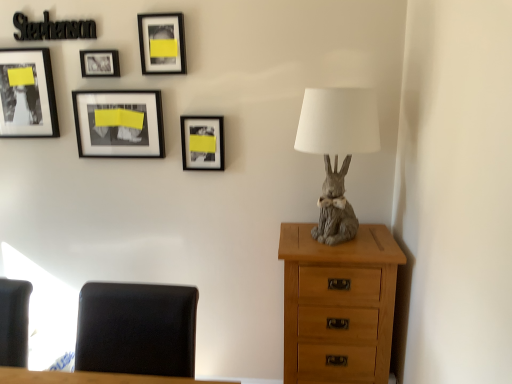
Question: Does light brown wood chest of drawers at right have a greater width compared to matte black frame at upper left, which ranks as the first picture frame in left-to-right order?

Choices:
 (A) yes
 (B) no

Answer: (A)

Question: Can we say light brown wood chest of drawers at right lies outside matte black frame at upper left, which ranks as the first picture frame in left-to-right order?

Choices:
 (A) yes
 (B) no

Answer: (A)

Question: Are light brown wood chest of drawers at right and matte black frame at upper left, which ranks as the first picture frame in left-to-right order, located far from each other?

Choices:
 (A) no
 (B) yes

Answer: (B)

Question: Considering the relative sizes of light brown wood chest of drawers at right and matte black frame at upper left, which ranks as the first picture frame in left-to-right order, in the image provided, is light brown wood chest of drawers at right thinner than matte black frame at upper left, which ranks as the first picture frame in left-to-right order,?

Choices:
 (A) no
 (B) yes

Answer: (A)

Question: Can you see light brown wood chest of drawers at right touching matte black frame at upper left, the fifth picture frame in the right-to-left sequence?

Choices:
 (A) yes
 (B) no

Answer: (B)

Question: Is black leather chair at lower left spatially inside matte black picture frame at center, which is the first picture frame in right-to-left order, or outside of it?

Choices:
 (A) inside
 (B) outside

Answer: (B)

Question: Is black leather chair at lower left in front of or behind matte black picture frame at center, which is the first picture frame in right-to-left order, in the image?

Choices:
 (A) front
 (B) behind

Answer: (A)

Question: Is point (193, 336) closer or farther from the camera than point (197, 127)?

Choices:
 (A) closer
 (B) farther

Answer: (A)

Question: In terms of height, does black leather chair at lower left look taller or shorter compared to matte black picture frame at center, which is the first picture frame in right-to-left order?

Choices:
 (A) tall
 (B) short

Answer: (A)

Question: In the image, is light brown wood chest of drawers at right on the left side or the right side of matte black frame at upper center, which is counted as the 2th picture frame, starting from the right?

Choices:
 (A) left
 (B) right

Answer: (B)

Question: Considering the positions of light brown wood chest of drawers at right and matte black frame at upper center, marked as the 4th picture frame in a left-to-right arrangement, in the image, is light brown wood chest of drawers at right wider or thinner than matte black frame at upper center, marked as the 4th picture frame in a left-to-right arrangement,?

Choices:
 (A) thin
 (B) wide

Answer: (B)

Question: From a real-world perspective, is light brown wood chest of drawers at right physically located above or below matte black frame at upper center, which is counted as the 2th picture frame, starting from the right?

Choices:
 (A) below
 (B) above

Answer: (A)

Question: Relative to matte black frame at upper center, which is counted as the 2th picture frame, starting from the right, is light brown wood chest of drawers at right in front or behind?

Choices:
 (A) front
 (B) behind

Answer: (A)

Question: Relative to black leather chair at lower left, is light brown wood chest of drawers at right in front or behind?

Choices:
 (A) behind
 (B) front

Answer: (A)

Question: From a real-world perspective, is light brown wood chest of drawers at right physically located above or below black leather chair at lower left?

Choices:
 (A) below
 (B) above

Answer: (A)